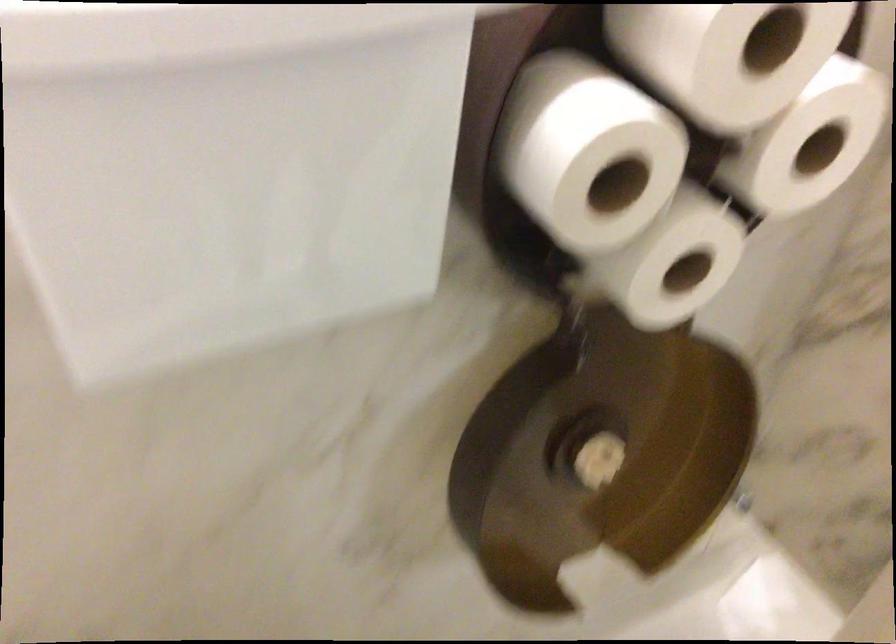
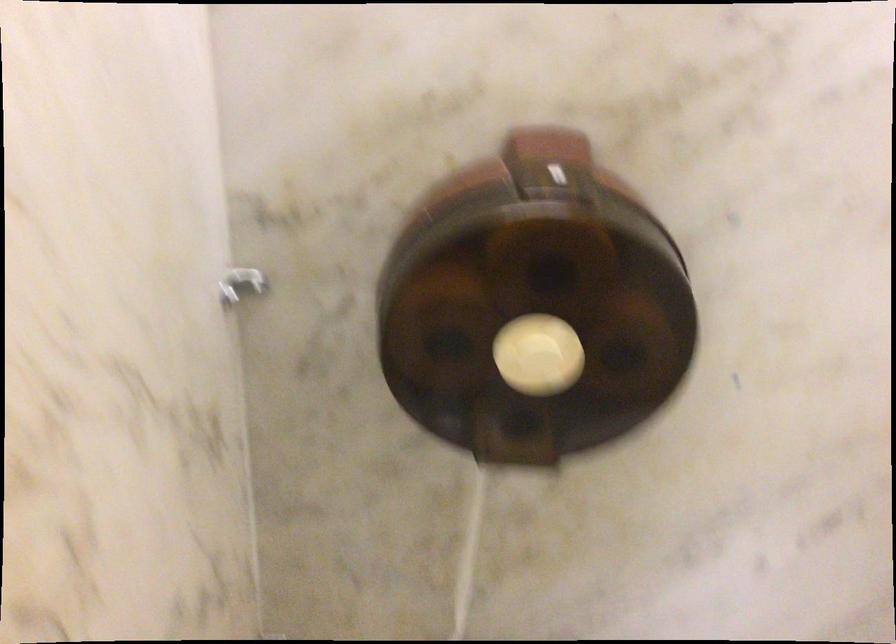
Question: Which direction would the cameraman need to move to produce the second image? Reply with the corresponding letter.

Choices:
 (A) Left
 (B) Right
 (C) Forward
 (D) Backward

Answer: (B)